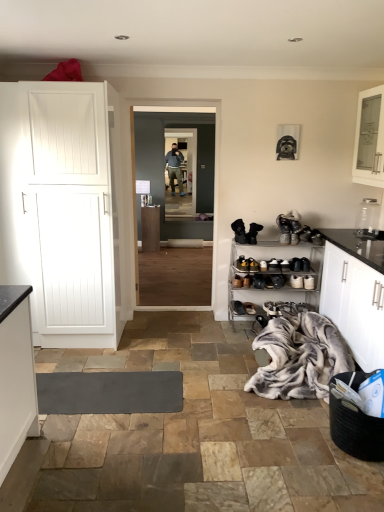
This screenshot has height=512, width=384. What do you see at coordinates (249, 308) in the screenshot?
I see `brown suede shoe at lower center, the third footwear from the bottom` at bounding box center [249, 308].

How much space does black leather boots at center, which appears as the 4th footwear when ordered from the bottom, occupy vertically?

21.55 centimeters.

This screenshot has height=512, width=384. What do you see at coordinates (253, 233) in the screenshot?
I see `black leather boots at center, which appears as the 4th footwear when ordered from the bottom` at bounding box center [253, 233].

What is the approximate height of black leather boots at center, arranged as the fifth footwear when ordered from the bottom?

It is 9.39 inches.

Where is `clear glass door at center, which ranks as the 2th glass door in front-to-back order`? This screenshot has height=512, width=384. clear glass door at center, which ranks as the 2th glass door in front-to-back order is located at coordinates (182, 173).

At what (x,y) coordinates should I click in order to perform the action: click on brown suede shoe at lower center, the 3th footwear in the top-to-bottom sequence. Please return your answer as a coordinate pair (x, y). Image resolution: width=384 pixels, height=512 pixels. Looking at the image, I should click on [x=249, y=308].

How much distance is there between black leather shoe at center, which is counted as the first footwear, starting from the bottom, and transparent glass jar at upper right?

black leather shoe at center, which is counted as the first footwear, starting from the bottom, is 1.30 meters away from transparent glass jar at upper right.

Between point (264, 327) and point (376, 215), which one is positioned in front?

The point (264, 327) is closer to the camera.

Does black leather shoe at center, which is counted as the first footwear, starting from the bottom, turn towards transparent glass jar at upper right?

No.

This screenshot has width=384, height=512. In order to click on appliance that is above the black leather shoe at center, acting as the 5th footwear starting from the top (from a real-world perspective) in this screenshot , I will do `click(367, 219)`.

Does black leather boots at center, the second footwear from the top, have a greater width compared to black leather boots at center, arranged as the fifth footwear when ordered from the bottom?

No.

From the image's perspective, which object appears higher, black leather boots at center, the second footwear from the top, or black leather boots at center, the 1th footwear from the top?

black leather boots at center, the 1th footwear from the top, is shown above in the image.

Is point (260, 224) positioned behind point (242, 241)?

That is False.

Is black leather boots at center, which appears as the 4th footwear when ordered from the bottom, bigger or smaller than black leather boots at center, the 1th footwear from the top?

In the image, black leather boots at center, which appears as the 4th footwear when ordered from the bottom, appears to be smaller than black leather boots at center, the 1th footwear from the top.

From the image's perspective, between metallic silver shoe rack at lower right and black leather boots at center, the second footwear from the top, which one is located above?

From the image's view, black leather boots at center, the second footwear from the top, is above.

Is metallic silver shoe rack at lower right inside or outside of black leather boots at center, which appears as the 4th footwear when ordered from the bottom?

metallic silver shoe rack at lower right exists outside the volume of black leather boots at center, which appears as the 4th footwear when ordered from the bottom.

Does metallic silver shoe rack at lower right have a greater width compared to black leather boots at center, the second footwear from the top?

Yes.

Between metallic silver shoe rack at lower right and black leather boots at center, the second footwear from the top, which one has smaller size?

black leather boots at center, the second footwear from the top, is smaller.

Is the position of fluffy gray blanket at lower right less distant than that of black leather boots at center, the second footwear from the top?

Yes, it is in front of black leather boots at center, the second footwear from the top.

From the image's perspective, is fluffy gray blanket at lower right over black leather boots at center, the second footwear from the top?

No, from the image's perspective, fluffy gray blanket at lower right is not over black leather boots at center, the second footwear from the top.

Does point (323, 371) come farther from viewer compared to point (254, 228)?

No.

From a real-world perspective, does transparent glass jar at upper right sit lower than brown suede shoe at lower center, the third footwear from the bottom?

No.

Between transparent glass jar at upper right and brown suede shoe at lower center, the third footwear from the bottom, which one appears on the left side from the viewer's perspective?

From the viewer's perspective, brown suede shoe at lower center, the third footwear from the bottom, appears more on the left side.

From the image's perspective, is transparent glass jar at upper right located beneath brown suede shoe at lower center, the third footwear from the bottom?

Incorrect, from the image's perspective, transparent glass jar at upper right is higher than brown suede shoe at lower center, the third footwear from the bottom.

Can you see transparent glass jar at upper right touching brown suede shoe at lower center, the third footwear from the bottom?

transparent glass jar at upper right and brown suede shoe at lower center, the third footwear from the bottom, are not in contact.

Is transparent glass jar at upper right touching black leather boots at center, arranged as the fifth footwear when ordered from the bottom?

transparent glass jar at upper right and black leather boots at center, arranged as the fifth footwear when ordered from the bottom, are clearly separated.

From the image's perspective, which footwear is the 1st one below the transparent glass jar at upper right? Please provide its 2D coordinates.

[(239, 231)]

Is black leather boots at center, arranged as the fifth footwear when ordered from the bottom, inside transparent glass jar at upper right?

No, black leather boots at center, arranged as the fifth footwear when ordered from the bottom, is not a part of transparent glass jar at upper right.

From a real-world perspective, which is physically above, transparent glass jar at upper right or black leather boots at center, arranged as the fifth footwear when ordered from the bottom?

transparent glass jar at upper right is physically above.

Can we say transparent glass door at center, which is the 2th glass door from back to front, lies outside black leather boots at center, the second footwear from the top?

transparent glass door at center, which is the 2th glass door from back to front, is positioned outside black leather boots at center, the second footwear from the top.

Does transparent glass door at center, the 1th glass door viewed from the front, touch black leather boots at center, the second footwear from the top?

transparent glass door at center, the 1th glass door viewed from the front, and black leather boots at center, the second footwear from the top, are not in contact.

Between transparent glass door at center, which is the 2th glass door from back to front, and black leather boots at center, the second footwear from the top, which one is positioned in front?

black leather boots at center, the second footwear from the top, is in front.

Considering the positions of point (162, 173) and point (257, 231), is point (162, 173) closer or farther from the camera than point (257, 231)?

Point (162, 173) is positioned farther from the camera compared to point (257, 231).

The width and height of the screenshot is (384, 512). Identify the location of appliance in front of the black leather shoe at center, which is counted as the first footwear, starting from the bottom. (367, 219).

Image resolution: width=384 pixels, height=512 pixels. I want to click on footwear above the black leather boots at center, the second footwear from the top (from the image's perspective), so click(239, 231).

Looking at the image, which one is located further to clear glass cabinet at upper right, fluffy gray blanket at lower right or clear glass door at center, which is counted as the 1th glass door, starting from the back?

clear glass door at center, which is counted as the 1th glass door, starting from the back, is further to clear glass cabinet at upper right.

Based on their spatial positions, is transparent glass door at center, the 1th glass door viewed from the front, or metallic silver shoe rack at lower right further from black leather shoe at center, which is counted as the first footwear, starting from the bottom?

transparent glass door at center, the 1th glass door viewed from the front, lies further to black leather shoe at center, which is counted as the first footwear, starting from the bottom, than the other object.

When comparing their distances from clear glass door at center, which is counted as the 1th glass door, starting from the back, does fluffy gray blanket at lower right or white matte cabinet at left seem further?

fluffy gray blanket at lower right.

Which object lies nearer to the anchor point fluffy gray blanket at lower right, clear glass cabinet at upper right or black leather shoe at lower center, the 4th footwear from the top?

black leather shoe at lower center, the 4th footwear from the top.

Which object lies nearer to the anchor point black leather shoe at lower center, the 4th footwear from the top, fluffy gray blanket at lower right or black leather shoe at center, which is counted as the first footwear, starting from the bottom?

black leather shoe at center, which is counted as the first footwear, starting from the bottom, is positioned closer to the anchor black leather shoe at lower center, the 4th footwear from the top.

Based on their spatial positions, is white matte cabinet at left or metallic silver shoe rack at lower right further from transparent glass door at center, the 1th glass door viewed from the front?

The object further to transparent glass door at center, the 1th glass door viewed from the front, is white matte cabinet at left.

Looking at the image, which one is located further to clear glass door at center, which is counted as the 1th glass door, starting from the back, black leather shoe at center, which is counted as the first footwear, starting from the bottom, or fluffy gray blanket at lower right?

The object further to clear glass door at center, which is counted as the 1th glass door, starting from the back, is fluffy gray blanket at lower right.

Based on their spatial positions, is white matte cabinet at left or brown suede shoe at lower center, the third footwear from the bottom, further from metallic silver shoe rack at lower right?

Based on the image, white matte cabinet at left appears to be further to metallic silver shoe rack at lower right.

Locate an element on the screen. This screenshot has height=512, width=384. glass door between black leather shoe at lower center, the 4th footwear from the top, and clear glass door at center, which ranks as the 2th glass door in front-to-back order, in the front-back direction is located at coordinates (164, 166).

Find the location of a particular element. This screenshot has width=384, height=512. glass door between metallic silver shoe rack at lower right and clear glass door at center, which ranks as the 2th glass door in front-to-back order, from front to back is located at coordinates (164, 166).

Identify the location of shelf between white glossy countertop at right and black leather boots at center, the second footwear from the top, along the z-axis. pos(271,275).

This screenshot has height=512, width=384. Identify the location of appliance between white glossy countertop at right and black leather boots at center, the 1th footwear from the top, from front to back. (367, 219).